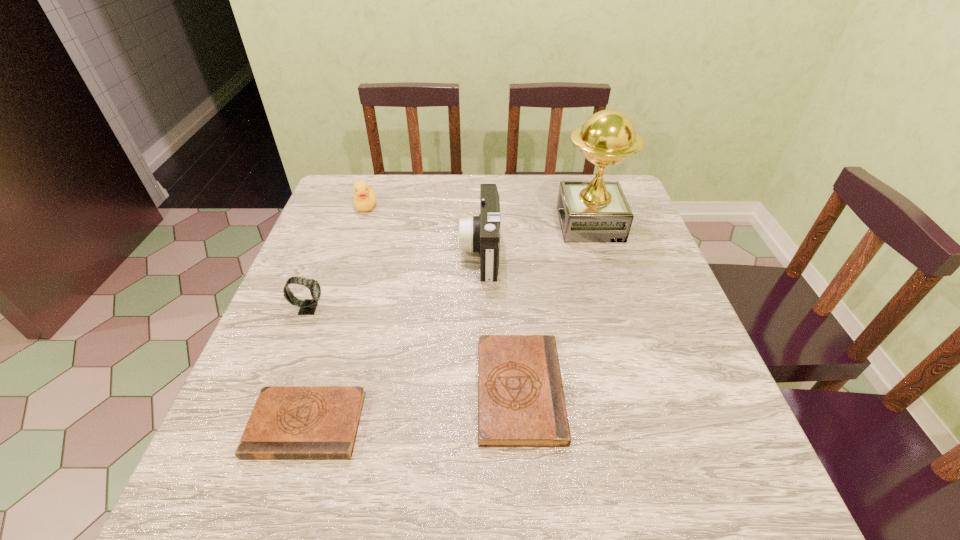
The width and height of the screenshot is (960, 540). Identify the location of diary situated at the left edge. (x=287, y=422).

Locate an element on the screen. The height and width of the screenshot is (540, 960). duckling at the left edge is located at coordinates (365, 198).

At what (x,y) coordinates should I click in order to perform the action: click on watch that is at the left edge. Please return your answer as a coordinate pair (x, y). Looking at the image, I should click on (307, 307).

Locate an element on the screen. This screenshot has height=540, width=960. object positioned at the right edge is located at coordinates (597, 211).

Find the location of `object that is at the far left corner`. object that is at the far left corner is located at coordinates (365, 198).

Locate an element on the screen. The width and height of the screenshot is (960, 540). object at the near left corner is located at coordinates (287, 422).

The image size is (960, 540). I want to click on object at the far right corner, so click(597, 211).

You are a GUI agent. You are given a task and a screenshot of the screen. Output one action in this format:
    pyautogui.click(x=<x>, y=<y>)
    Task: Click on the vacant point at the far edge
    Image resolution: width=960 pixels, height=540 pixels.
    Given the screenshot: What is the action you would take?
    pyautogui.click(x=450, y=204)

Locate an element on the screen. The height and width of the screenshot is (540, 960). vacant region at the left edge of the desktop is located at coordinates click(x=317, y=323).

The width and height of the screenshot is (960, 540). In order to click on vacant space at the right edge in this screenshot , I will do `click(687, 316)`.